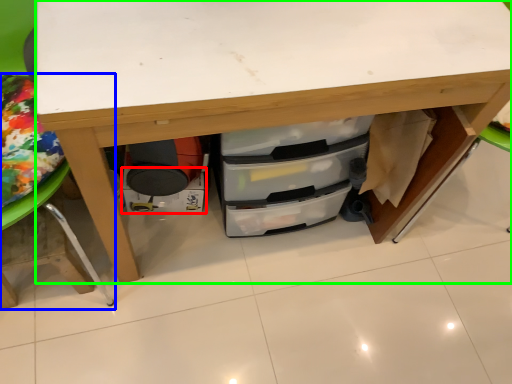
Question: Estimate the real-world distances between objects in this image. Which object is farther from drawer (highlighted by a red box), furniture (highlighted by a blue box) or desk (highlighted by a green box)?

Choices:
 (A) furniture
 (B) desk

Answer: (B)